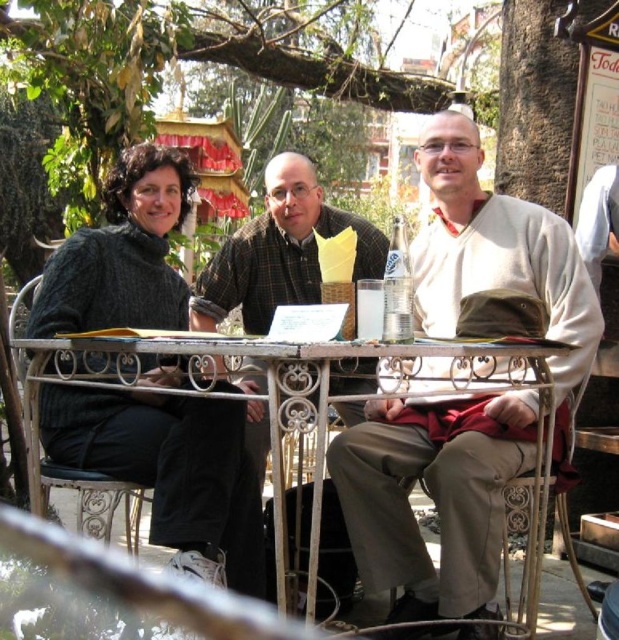
You are a photographer at the outdoor cafe and want to capture a photo of the dark gray knitted sweater at left and the white wrought iron table at center. Can you tell me if the sweater is placed on top of the table or beside it?

The dark gray knitted sweater at left is positioned over white wrought iron table at center, so the sweater is placed on top of the table.

You are a photographer trying to capture a group photo of the three people at the outdoor cafe. You want to ensure that the dark gray knitted sweater at left and the white wrought iron table at center are both in focus. Which object should you focus on first to ensure both are sharp?

The dark gray knitted sweater at left is thinner than the white wrought iron table at center, so you should focus on the white wrought iron table at center first to ensure both are in focus.

You are a photographer trying to capture a closeup of the white wrought iron table at center. However, the matte beige sweater at center is blocking your view. Can you determine if the sweater is on top of the table or just hanging nearby?

The matte beige sweater at center is positioned over the white wrought iron table at center, so it is blocking the view of the table because it is placed on top of it.